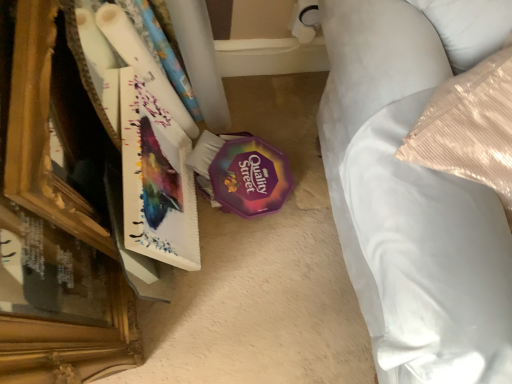
Identify the location of white satin bed at right. Image resolution: width=512 pixels, height=384 pixels. tap(413, 196).

Describe the element at coordinates (413, 196) in the screenshot. This screenshot has height=384, width=512. I see `white satin bed at right` at that location.

Consider the image. Measure the distance between matte paperboard book at left and camera.

30.59 inches.

What do you see at coordinates (156, 180) in the screenshot? I see `matte paperboard book at left` at bounding box center [156, 180].

Identify the location of matte paperboard book at left. This screenshot has width=512, height=384. (156, 180).

In order to click on white satin bed at right in this screenshot , I will do `click(413, 196)`.

Between white satin bed at right and matte paperboard book at left, which one appears on the left side from the viewer's perspective?

Positioned to the left is matte paperboard book at left.

Considering their positions, is white satin bed at right located in front of or behind matte paperboard book at left?

white satin bed at right is positioned closer to the viewer than matte paperboard book at left.

Is point (401, 330) closer or farther from the camera than point (136, 129)?

Clearly, point (401, 330) is closer to the camera than point (136, 129).

From the image's perspective, would you say white satin bed at right is positioned over matte paperboard book at left?

Yes, from the image's perspective, white satin bed at right is above matte paperboard book at left.

From a real-world perspective, which is physically above, white satin bed at right or matte paperboard book at left?

In real-world perspective, white satin bed at right is above.

Which of these two, white satin bed at right or matte paperboard book at left, is wider?

Wider between the two is white satin bed at right.

Can you confirm if white satin bed at right is shorter than matte paperboard book at left?

No, white satin bed at right is not shorter than matte paperboard book at left.

Which of these two, white satin bed at right or matte paperboard book at left, is bigger?

white satin bed at right is bigger.

Can matte paperboard book at left be found inside white satin bed at right?

No, matte paperboard book at left is not inside white satin bed at right.

Would you consider white satin bed at right to be distant from matte paperboard book at left?

They are positioned close to each other.

Is white satin bed at right facing away from matte paperboard book at left?

white satin bed at right is not turned away from matte paperboard book at left.

What's the angular difference between white satin bed at right and matte paperboard book at left's facing directions?

The facing directions of white satin bed at right and matte paperboard book at left are 60.1 degrees apart.

Locate an element on the screen. This screenshot has width=512, height=384. paperback book below the white satin bed at right (from a real-world perspective) is located at coordinates (156, 180).

From the picture: Is matte paperboard book at left at the right side of white satin bed at right?

No, matte paperboard book at left is not to the right of white satin bed at right.

Between matte paperboard book at left and white satin bed at right, which one is positioned in front?

white satin bed at right is more forward.

Considering the positions of points (159, 176) and (414, 90), is point (159, 176) farther from camera compared to point (414, 90)?

Yes, point (159, 176) is farther from viewer.

From the image's perspective, which is below, matte paperboard book at left or white satin bed at right?

matte paperboard book at left.

From a real-world perspective, is matte paperboard book at left over white satin bed at right?

No.

Between matte paperboard book at left and white satin bed at right, which one has larger width?

white satin bed at right.

Who is shorter, matte paperboard book at left or white satin bed at right?

matte paperboard book at left.

Considering the relative sizes of matte paperboard book at left and white satin bed at right in the image provided, is matte paperboard book at left bigger than white satin bed at right?

No.

Is white satin bed at right completely or partially inside matte paperboard book at left?

No, white satin bed at right is not a part of matte paperboard book at left.

In the scene shown: Would you say matte paperboard book at left is a long distance from white satin bed at right?

No, matte paperboard book at left is not far away from white satin bed at right.

Could you tell me if matte paperboard book at left is turned towards white satin bed at right?

Yes, matte paperboard book at left is turned towards white satin bed at right.

How many degrees apart are the facing directions of matte paperboard book at left and white satin bed at right?

The angular difference between matte paperboard book at left and white satin bed at right is 60.1 degrees.

I want to click on furniture that appears in front of the matte paperboard book at left, so pyautogui.click(x=413, y=196).

Identify the location of paperback book on the left of the white satin bed at right. (156, 180).

At what (x,y) coordinates should I click in order to perform the action: click on furniture that is above the matte paperboard book at left (from a real-world perspective). Please return your answer as a coordinate pair (x, y). This screenshot has width=512, height=384. Looking at the image, I should click on (413, 196).